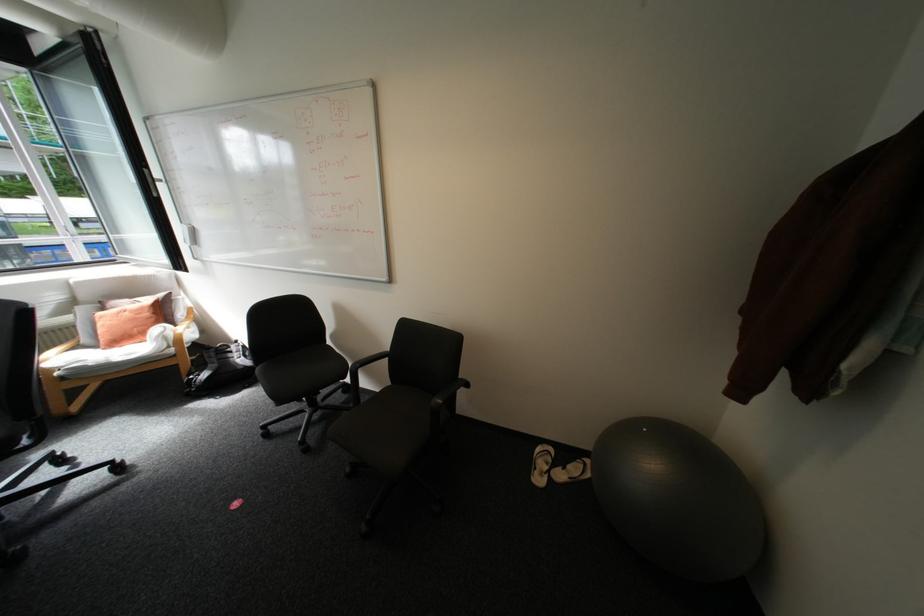
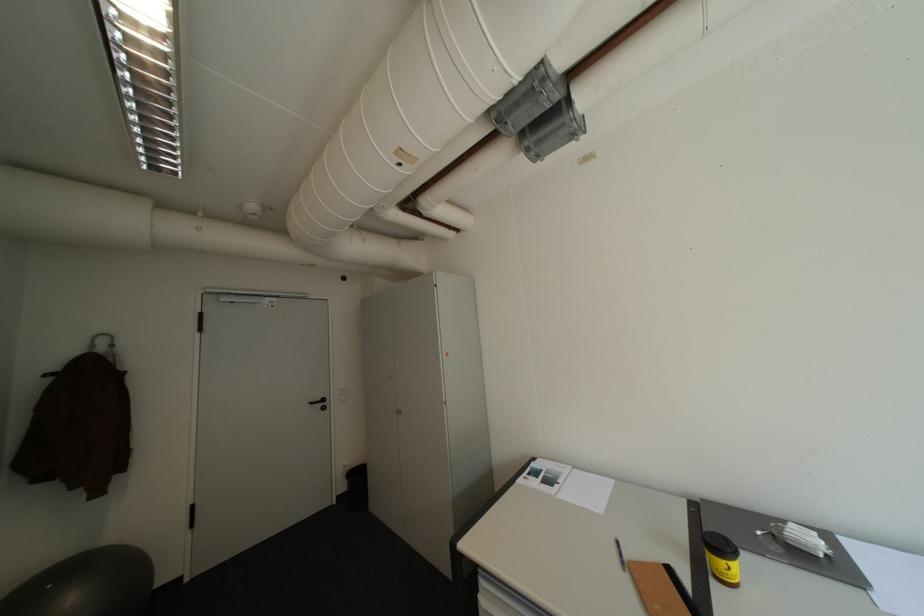
Locate, in the second image, the point that corresponds to the point at 654,430 in the first image.

(59, 586)